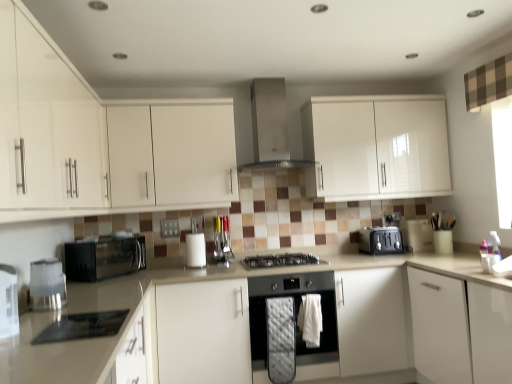
The image size is (512, 384). I want to click on white glossy countertop at lower left, so (71, 341).

Locate an element on the screen. This screenshot has height=384, width=512. white plastic blender at lower left, the fifth appliance from the right is located at coordinates (8, 302).

The height and width of the screenshot is (384, 512). I want to click on white glossy cabinet at upper center, which is the fourth cabinetry in left-to-right order, so click(x=376, y=147).

Identify the location of stainless steel oven at center, the 1th home appliance when ordered from right to left. Image resolution: width=512 pixels, height=384 pixels. (294, 315).

Describe the element at coordinates (222, 239) in the screenshot. I see `metallic silver utensil rack at center, which is the second appliance in back-to-front order` at that location.

At what (x,y) coordinates should I click in order to perform the action: click on white paper towel at center, acting as the third appliance starting from the back. Please return your answer as a coordinate pair (x, y). This screenshot has height=384, width=512. Looking at the image, I should click on (196, 244).

The height and width of the screenshot is (384, 512). What are the coordinates of `white glossy countertop at lower left` in the screenshot? It's located at (71, 341).

Considering the sizes of objects white matte cabinet at right, the fifth cabinetry in the left-to-right sequence, and stainless steel range hood at upper center, which is counted as the first home appliance, starting from the top, in the image provided, who is taller, white matte cabinet at right, the fifth cabinetry in the left-to-right sequence, or stainless steel range hood at upper center, which is counted as the first home appliance, starting from the top,?

white matte cabinet at right, the fifth cabinetry in the left-to-right sequence.

Which object is closer to the camera taking this photo, white matte cabinet at right, the fifth cabinetry in the left-to-right sequence, or stainless steel range hood at upper center, marked as the second home appliance in a right-to-left arrangement?

white matte cabinet at right, the fifth cabinetry in the left-to-right sequence, is more forward.

From a real-world perspective, which is physically below, white matte cabinet at right, the 1th cabinetry from the right, or stainless steel range hood at upper center, acting as the second home appliance starting from the left?

white matte cabinet at right, the 1th cabinetry from the right.

From the image's perspective, which cabinetry is the 5th one below the stainless steel range hood at upper center, placed as the 3th home appliance when sorted from bottom to top? Please provide its 2D coordinates.

[(460, 329)]

The width and height of the screenshot is (512, 384). I want to click on gas stove in front of the white glossy cabinet at upper center, the 2th cabinetry when ordered from right to left, so click(280, 260).

From a real-world perspective, does white glossy cabinet at upper center, which is the fourth cabinetry in left-to-right order, stand above black matte gas stove at center?

Yes, from a real-world perspective, white glossy cabinet at upper center, which is the fourth cabinetry in left-to-right order, is above black matte gas stove at center.

From the image's perspective, between white glossy cabinet at upper center, the 2th cabinetry when ordered from right to left, and black matte gas stove at center, which one is located above?

white glossy cabinet at upper center, the 2th cabinetry when ordered from right to left.

Which object is further away from the camera, white matte cabinet at upper left, the second cabinetry in the left-to-right sequence, or white glossy cabinet at upper center, the 2th cabinetry when ordered from right to left?

white glossy cabinet at upper center, the 2th cabinetry when ordered from right to left.

From the image's perspective, count 1st cabinetrys downward from the white glossy cabinet at upper center, the 2th cabinetry when ordered from right to left, and point to it. Please provide its 2D coordinates.

[(100, 139)]

Is white matte cabinet at upper left, which appears as the fourth cabinetry when viewed from the right, not near white glossy cabinet at upper center, the 2th cabinetry when ordered from right to left?

Yes, white matte cabinet at upper left, which appears as the fourth cabinetry when viewed from the right, and white glossy cabinet at upper center, the 2th cabinetry when ordered from right to left, are quite far apart.

Between white matte cabinet at upper left, which appears as the fourth cabinetry when viewed from the right, and white glossy cabinet at upper center, which is the fourth cabinetry in left-to-right order, which one appears on the right side from the viewer's perspective?

white glossy cabinet at upper center, which is the fourth cabinetry in left-to-right order, is more to the right.

Is black glass cooktop at lower left, the first appliance positioned from the front, wider or thinner than white paper towel at center, marked as the 3th appliance in a front-to-back arrangement?

Clearly, black glass cooktop at lower left, the first appliance positioned from the front, has more width compared to white paper towel at center, marked as the 3th appliance in a front-to-back arrangement.

Is black glass cooktop at lower left, acting as the 5th appliance starting from the back, not near white paper towel at center, marked as the 3th appliance in a front-to-back arrangement?

That's right, there is a large distance between black glass cooktop at lower left, acting as the 5th appliance starting from the back, and white paper towel at center, marked as the 3th appliance in a front-to-back arrangement.

Is black glass cooktop at lower left, acting as the 5th appliance starting from the back, smaller than white paper towel at center, marked as the 3th appliance in a right-to-left arrangement?

Yes.

Is white glossy cabinet at upper center, the 2th cabinetry when ordered from right to left, at the back of black glass cooktop at lower left, which appears as the second appliance when viewed from the left?

No, black glass cooktop at lower left, which appears as the second appliance when viewed from the left,'s orientation is not away from white glossy cabinet at upper center, the 2th cabinetry when ordered from right to left.

How many degrees apart are the facing directions of black glass cooktop at lower left, the first appliance positioned from the front, and white glossy cabinet at upper center, the 2th cabinetry when ordered from right to left?

90 degrees.

Considering the relative sizes of black glass cooktop at lower left, the first appliance positioned from the front, and white glossy cabinet at upper center, which is the fourth cabinetry in left-to-right order, in the image provided, is black glass cooktop at lower left, the first appliance positioned from the front, bigger than white glossy cabinet at upper center, which is the fourth cabinetry in left-to-right order,?

No, black glass cooktop at lower left, the first appliance positioned from the front, is not bigger than white glossy cabinet at upper center, which is the fourth cabinetry in left-to-right order.

Does black glass cooktop at lower left, placed as the fourth appliance when sorted from right to left, have a lesser height compared to white glossy cabinet at upper center, which is the fourth cabinetry in left-to-right order?

Correct, black glass cooktop at lower left, placed as the fourth appliance when sorted from right to left, is not as tall as white glossy cabinet at upper center, which is the fourth cabinetry in left-to-right order.

Who is smaller, black plastic toaster at right or black glossy microwave at left, the third home appliance from the right?

black plastic toaster at right.

Which of these two, black plastic toaster at right or black glossy microwave at left, the second home appliance positioned from the top, is wider?

Wider between the two is black glossy microwave at left, the second home appliance positioned from the top.

Between black plastic toaster at right and black glossy microwave at left, marked as the first home appliance in a left-to-right arrangement, which one is positioned in front?

black glossy microwave at left, marked as the first home appliance in a left-to-right arrangement, is in front.

Does satin silver toaster at right, which is counted as the 5th appliance, starting from the front, have a greater width compared to metallic silver utensil rack at center, placed as the second appliance when sorted from right to left?

Yes.

What's the angular difference between satin silver toaster at right, which ranks as the 1th appliance in back-to-front order, and metallic silver utensil rack at center, the fourth appliance from the front,'s facing directions?

0.836 degrees.

Considering the points (414, 243) and (227, 240), which point is in front, point (414, 243) or point (227, 240)?

The point (227, 240) is more forward.

Considering the relative positions of satin silver toaster at right, which is counted as the 1th appliance, starting from the right, and metallic silver utensil rack at center, placed as the second appliance when sorted from right to left, in the image provided, is satin silver toaster at right, which is counted as the 1th appliance, starting from the right, to the right of metallic silver utensil rack at center, placed as the second appliance when sorted from right to left, from the viewer's perspective?

Correct, you'll find satin silver toaster at right, which is counted as the 1th appliance, starting from the right, to the right of metallic silver utensil rack at center, placed as the second appliance when sorted from right to left.

The height and width of the screenshot is (384, 512). What are the coordinates of `the 2nd home appliance to the left of the white matte cabinet at right, the fifth cabinetry in the left-to-right sequence, starting your count from the anchor` in the screenshot? It's located at [270, 124].

The width and height of the screenshot is (512, 384). In the image, there is a white glossy cabinet at upper center, which is the fourth cabinetry in left-to-right order. Find the location of `gas stove below it (from the image's perspective)`. gas stove below it (from the image's perspective) is located at coordinates (280, 260).

From the image, which object appears to be nearer to white matte cabinet at right, the fifth cabinetry in the left-to-right sequence, white plastic blender at lower left, the fifth appliance from the right, or metallic silver utensil rack at center, placed as the second appliance when sorted from right to left?

The object closer to white matte cabinet at right, the fifth cabinetry in the left-to-right sequence, is metallic silver utensil rack at center, placed as the second appliance when sorted from right to left.

When comparing their distances from stainless steel oven at center, which appears as the 3th home appliance when viewed from the left, does white matte cabinet at upper left, marked as the 3th cabinetry in a left-to-right arrangement, or white glossy cabinet at left, the 5th cabinetry from the right, seem further?

Based on the image, white glossy cabinet at left, the 5th cabinetry from the right, appears to be further to stainless steel oven at center, which appears as the 3th home appliance when viewed from the left.

Which object lies nearer to the anchor point metallic silver kettle at left, black plastic toaster at right or white matte cabinet at upper left, the second cabinetry in the left-to-right sequence?

The object closer to metallic silver kettle at left is white matte cabinet at upper left, the second cabinetry in the left-to-right sequence.

Estimate the real-world distances between objects in this image. Which object is closer to white matte cabinet at right, the fifth cabinetry in the left-to-right sequence, white glossy cabinet at upper center, which is the fourth cabinetry in left-to-right order, or black plastic toaster at right?

Among the two, black plastic toaster at right is located nearer to white matte cabinet at right, the fifth cabinetry in the left-to-right sequence.

Estimate the real-world distances between objects in this image. Which object is further from metallic silver kettle at left, stainless steel range hood at upper center, placed as the 3th home appliance when sorted from bottom to top, or white glossy countertop at lower left?

stainless steel range hood at upper center, placed as the 3th home appliance when sorted from bottom to top, is positioned further to the anchor metallic silver kettle at left.

Estimate the real-world distances between objects in this image. Which object is closer to white plastic blender at lower left, the 1th appliance positioned from the left, white matte cabinet at upper left, which appears as the fourth cabinetry when viewed from the right, or white matte cabinet at right, the fifth cabinetry in the left-to-right sequence?

white matte cabinet at upper left, which appears as the fourth cabinetry when viewed from the right, lies closer to white plastic blender at lower left, the 1th appliance positioned from the left, than the other object.

Based on their spatial positions, is white glossy countertop at lower left or white paper towel at center, marked as the 3th appliance in a front-to-back arrangement, further from white glossy countertop at center?

white glossy countertop at lower left is further to white glossy countertop at center.

In the scene shown: Which object lies nearer to the anchor point black glossy microwave at left, the second home appliance in the bottom-to-top sequence, stainless steel range hood at upper center, acting as the second home appliance starting from the left, or metallic silver utensil rack at center, placed as the second appliance when sorted from right to left?

The object closer to black glossy microwave at left, the second home appliance in the bottom-to-top sequence, is metallic silver utensil rack at center, placed as the second appliance when sorted from right to left.

What are the coordinates of `appliance between white paper towel at center, acting as the third appliance starting from the back, and black plastic toaster at right` in the screenshot? It's located at (222, 239).

Identify the location of kitchen appliance located between white glossy countertop at lower left and white glossy cabinet at upper center, the 2th cabinetry when ordered from right to left, in the depth direction. The image size is (512, 384). (47, 285).

Identify the location of gas stove between metallic silver kettle at left and white glossy cabinet at upper center, which is the fourth cabinetry in left-to-right order, from left to right. The height and width of the screenshot is (384, 512). (280, 260).

Image resolution: width=512 pixels, height=384 pixels. Find the location of `counter top between white glossy countertop at center and white glossy cabinet at upper center, the 2th cabinetry when ordered from right to left, in the front-back direction`. counter top between white glossy countertop at center and white glossy cabinet at upper center, the 2th cabinetry when ordered from right to left, in the front-back direction is located at coordinates (71, 341).